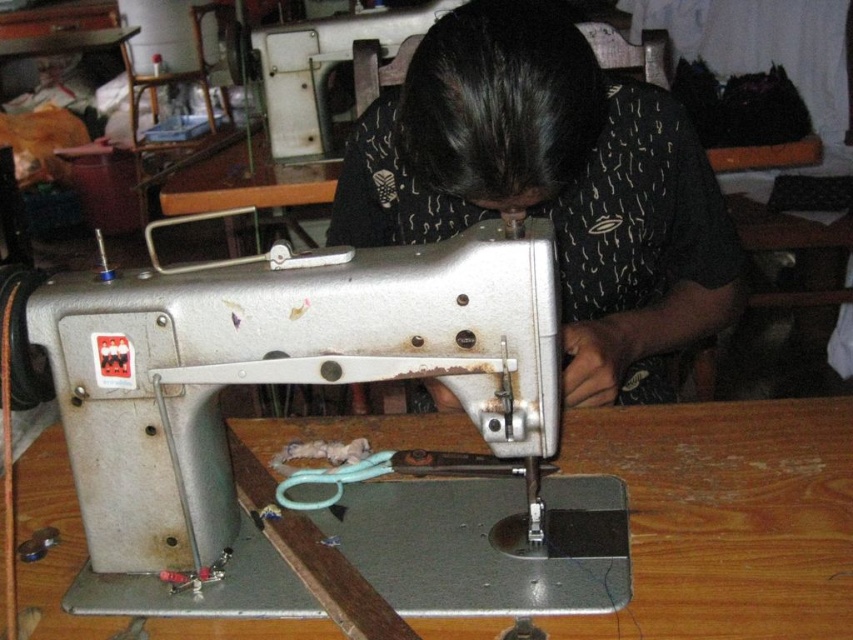
Question: Can you confirm if silver metallic sewing machine at center is bigger than wooden table at center?

Choices:
 (A) yes
 (B) no

Answer: (B)

Question: Which point is closer to the camera?

Choices:
 (A) black printed shirt at upper center
 (B) wooden table at center

Answer: (B)

Question: Which object is positioned farthest from the wooden table at center?

Choices:
 (A) silver metallic sewing machine at center
 (B) black printed shirt at upper center

Answer: (B)

Question: Among these objects, which one is farthest from the camera?

Choices:
 (A) black printed shirt at upper center
 (B) silver metallic sewing machine at center
 (C) wooden table at center

Answer: (A)

Question: Can you confirm if silver metallic sewing machine at center is bigger than black printed shirt at upper center?

Choices:
 (A) yes
 (B) no

Answer: (B)

Question: In this image, where is silver metallic sewing machine at center located relative to wooden table at center?

Choices:
 (A) above
 (B) below

Answer: (A)